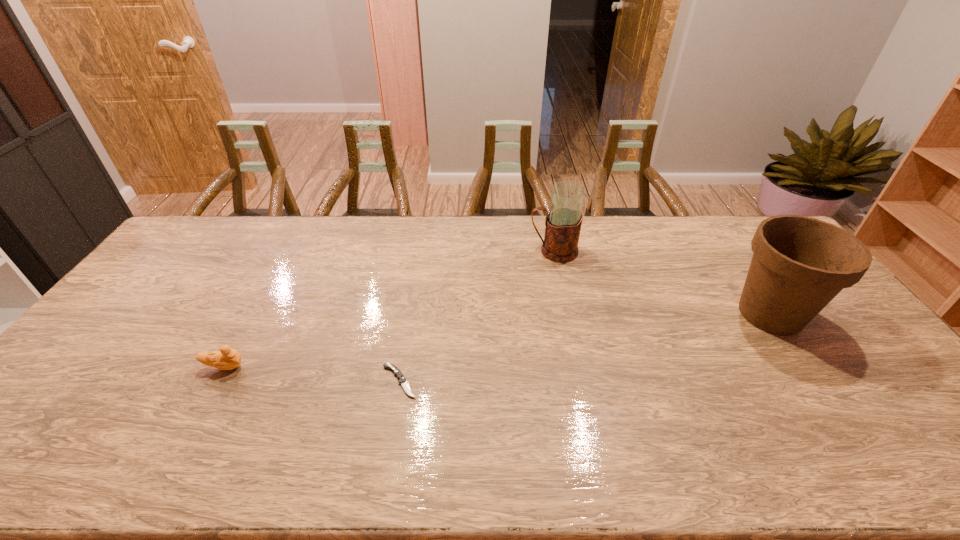
The height and width of the screenshot is (540, 960). Identify the location of the second farthest object. (799, 264).

The height and width of the screenshot is (540, 960). I want to click on flowerpot, so click(799, 264).

This screenshot has height=540, width=960. I want to click on the farthest object, so click(x=563, y=223).

The height and width of the screenshot is (540, 960). I want to click on pitcher, so click(x=563, y=223).

At what (x,y) coordinates should I click in order to perform the action: click on duckling. Please return your answer as a coordinate pair (x, y). Image resolution: width=960 pixels, height=540 pixels. Looking at the image, I should click on (226, 358).

At what (x,y) coordinates should I click in order to perform the action: click on the second shortest object. Please return your answer as a coordinate pair (x, y). This screenshot has height=540, width=960. Looking at the image, I should click on (226, 358).

The width and height of the screenshot is (960, 540). Identify the location of the shortest object. (402, 380).

Where is `pocketknife`? Image resolution: width=960 pixels, height=540 pixels. pocketknife is located at coordinates (402, 380).

Where is `vacant position located on the back of the second farthest object`? Image resolution: width=960 pixels, height=540 pixels. vacant position located on the back of the second farthest object is located at coordinates (721, 242).

Find the location of `vacant space located 0.370m with the handle on the side of the pitcher`. vacant space located 0.370m with the handle on the side of the pitcher is located at coordinates (422, 251).